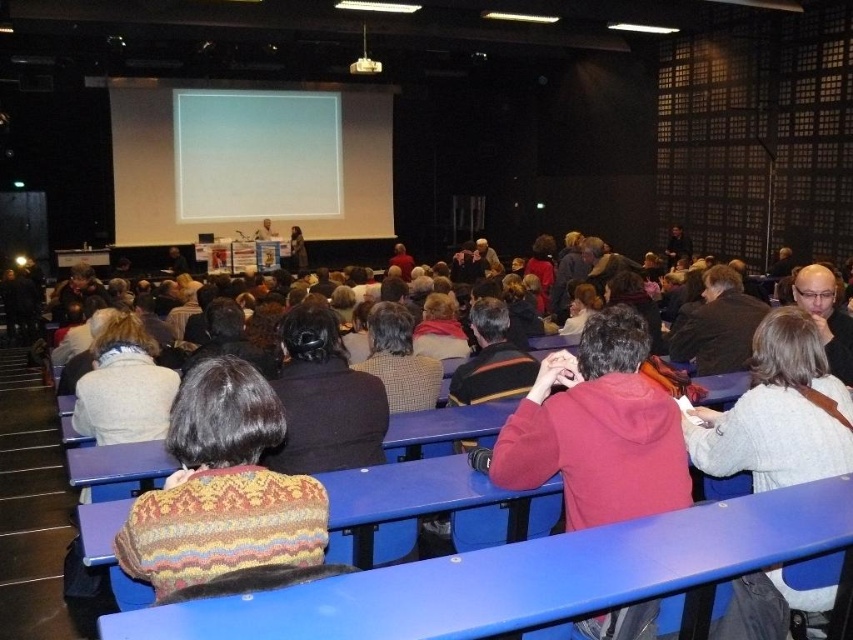
You are standing at the back of the lecture hall and want to take a photo of two points in the image. The first point is point (224,97) and the second point is point (392,314). Which point will appear closer to you in the photo?

Point (224,97) will appear closer to you in the photo because it is further to the camera than point (392,314).

You are sitting in the audience of the lecture hall and want to take a photo of the presentation. The white matte projection screen at upper center and the checkered fabric sweater at center are both in your camera frame. Which object should you focus on to ensure the presentation content is clearly visible in your photo?

You should focus on the white matte projection screen at upper center because it has a larger size compared to the checkered fabric sweater at center, making it easier to capture the presentation content clearly.

You are sitting in the blue plastic chairs at the back of the lecture hall. You want to see the presentation on the white matte projection screen at upper center but notice the white fuzzy sweater at center is blocking your view. Can you see the screen over the sweater?

The white matte projection screen at upper center is further to the viewer than the white fuzzy sweater at center, meaning the screen is closer to you. Since the screen is closer, it should be visible above the sweater if positioned correctly. However, if the sweater is directly in front of the screen, it might still block the view. Without knowing the exact positions, it is uncertain.